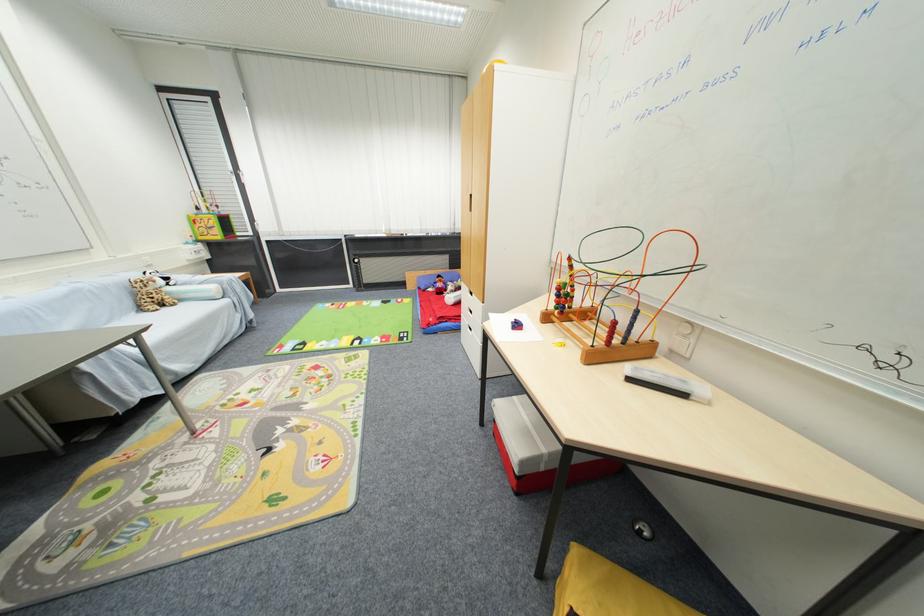
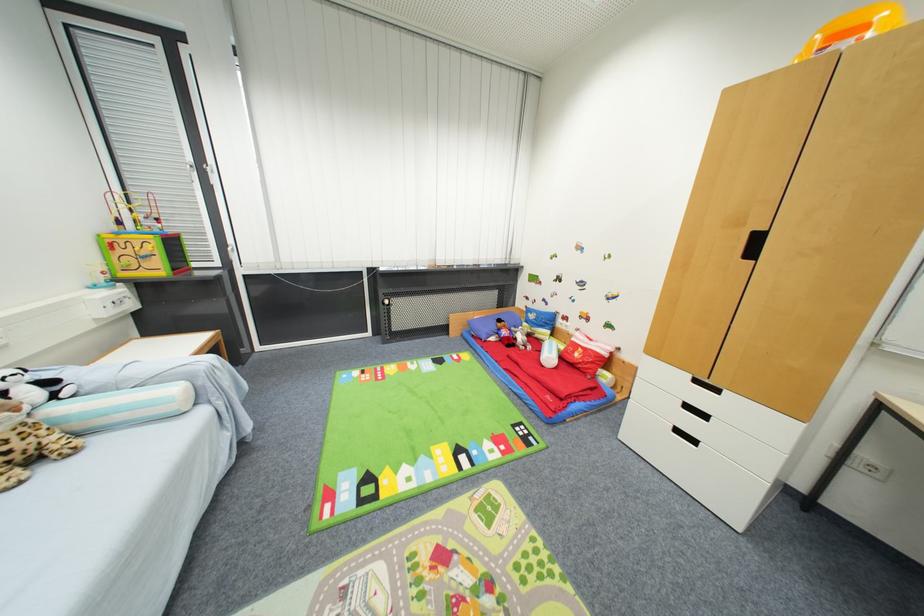
Locate, in the second image, the point that corresponds to (x=371, y=342) in the first image.

(479, 455)